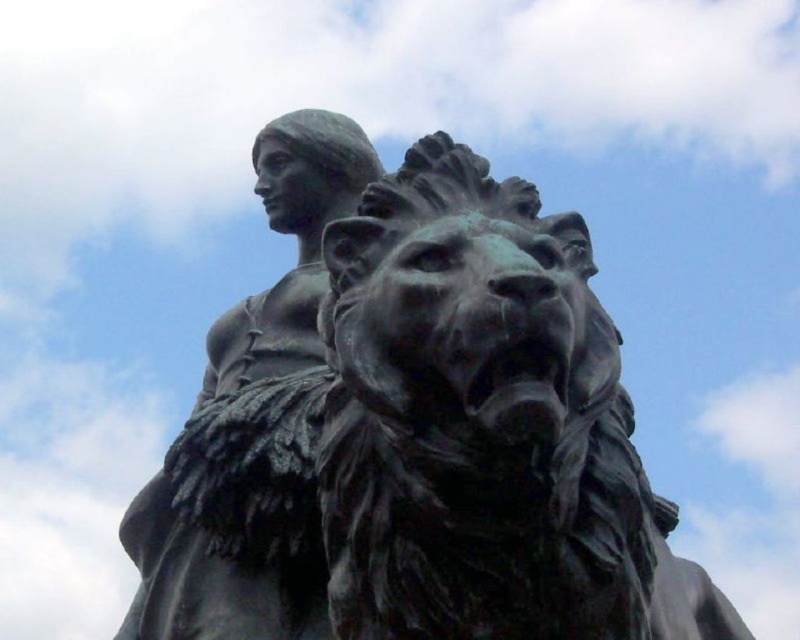
Can you confirm if bronze statue at center is shorter than matte bronze statue at upper left?

No, bronze statue at center is not shorter than matte bronze statue at upper left.

Can you confirm if bronze statue at center is positioned above matte bronze statue at upper left?

No.

Is point (621, 408) positioned before point (197, 408)?

Yes, point (621, 408) is in front of point (197, 408).

In order to click on bronze statue at center in this screenshot , I will do `click(412, 428)`.